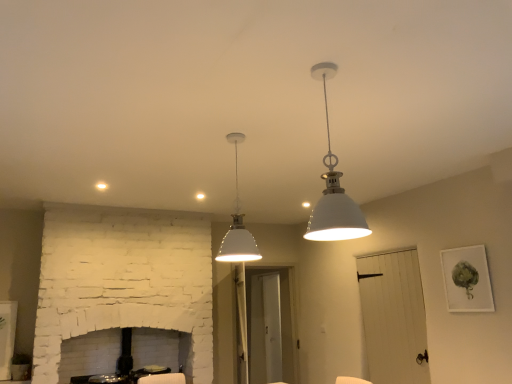
Question: Does white matte pendant light at upper center, the first lamp viewed from the front, have a greater height compared to white matte pendant light at center, which is the 1th lamp in left-to-right order?

Choices:
 (A) yes
 (B) no

Answer: (B)

Question: Would you say white matte pendant light at upper center, acting as the 1th lamp starting from the right, is a long distance from white matte pendant light at center, which is the 1th lamp in left-to-right order?

Choices:
 (A) yes
 (B) no

Answer: (B)

Question: Is white matte pendant light at upper center, which is the second lamp in left-to-right order, placed right next to white matte pendant light at center, the first lamp in the back-to-front sequence?

Choices:
 (A) yes
 (B) no

Answer: (B)

Question: From the image's perspective, is white matte pendant light at upper center, acting as the 1th lamp starting from the right, above white matte pendant light at center, the first lamp in the back-to-front sequence?

Choices:
 (A) no
 (B) yes

Answer: (B)

Question: Could you tell me if white matte pendant light at upper center, acting as the 1th lamp starting from the right, is facing white matte pendant light at center, which is counted as the 2th lamp, starting from the front?

Choices:
 (A) yes
 (B) no

Answer: (A)

Question: Is white matte pendant light at upper center, the first lamp viewed from the front, to the left or to the right of matte white picture frame at upper right in the image?

Choices:
 (A) left
 (B) right

Answer: (A)

Question: From their relative heights in the image, would you say white matte pendant light at upper center, acting as the 1th lamp starting from the right, is taller or shorter than matte white picture frame at upper right?

Choices:
 (A) short
 (B) tall

Answer: (B)

Question: Relative to matte white picture frame at upper right, is white matte pendant light at upper center, acting as the 1th lamp starting from the right, in front or behind?

Choices:
 (A) behind
 (B) front

Answer: (B)

Question: From the image's perspective, is white matte pendant light at upper center, the first lamp viewed from the front, located above or below matte white picture frame at upper right?

Choices:
 (A) below
 (B) above

Answer: (B)

Question: Is matte white picture frame at upper right to the left or to the right of white wood door at lower right in the image?

Choices:
 (A) right
 (B) left

Answer: (A)

Question: From the image's perspective, is matte white picture frame at upper right located above or below white wood door at lower right?

Choices:
 (A) below
 (B) above

Answer: (B)

Question: Based on their sizes in the image, would you say matte white picture frame at upper right is bigger or smaller than white wood door at lower right?

Choices:
 (A) big
 (B) small

Answer: (B)

Question: Considering the positions of matte white picture frame at upper right and white wood door at lower right in the image, is matte white picture frame at upper right taller or shorter than white wood door at lower right?

Choices:
 (A) tall
 (B) short

Answer: (B)

Question: In the image, is white matte pendant light at upper center, the first lamp viewed from the front, on the left side or the right side of white matte pendant light at center, which is counted as the 2th lamp, starting from the front?

Choices:
 (A) right
 (B) left

Answer: (A)

Question: In the image, is white matte pendant light at upper center, which is the second lamp in left-to-right order, positioned in front of or behind white matte pendant light at center, which is the 1th lamp in left-to-right order?

Choices:
 (A) front
 (B) behind

Answer: (A)